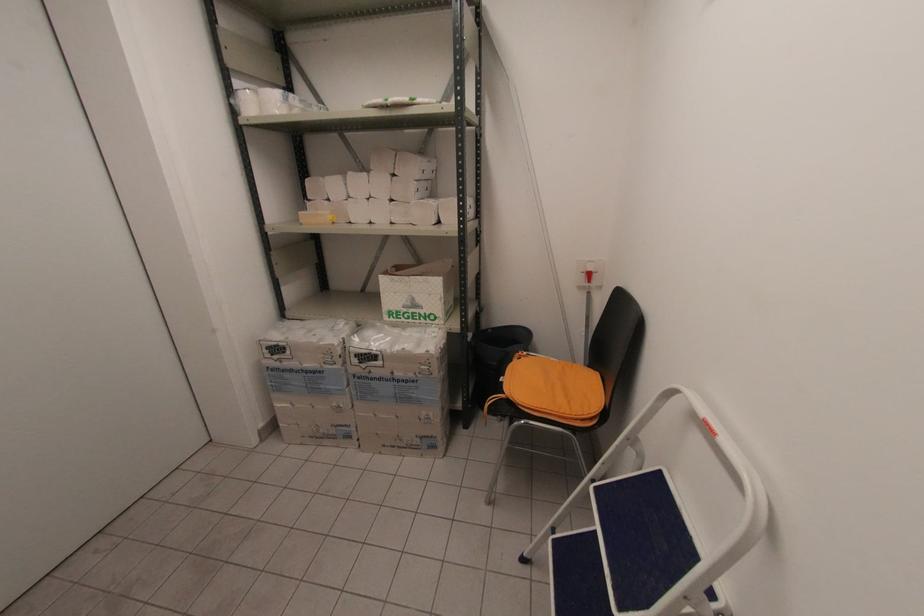
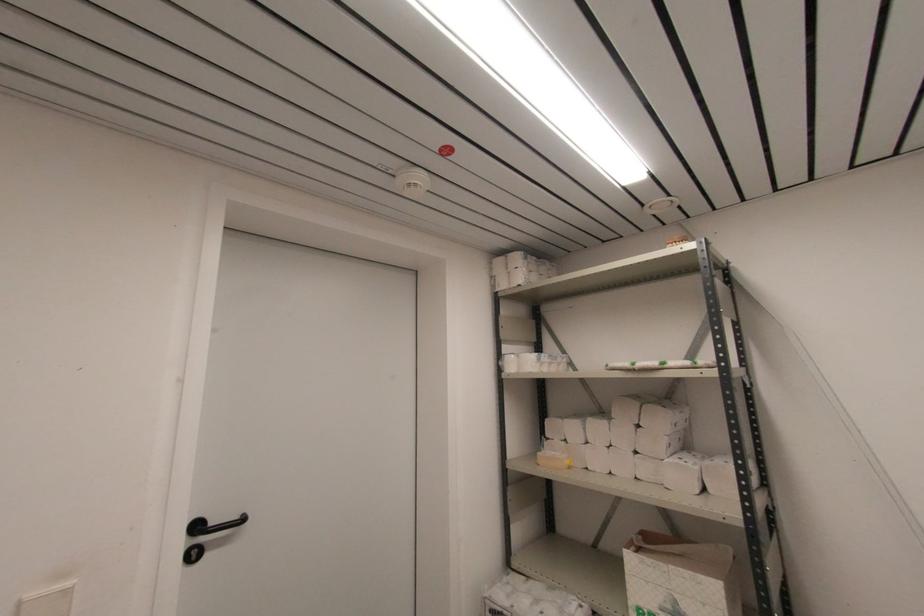
In the second image, find the point that corresponds to (x=310, y=198) in the first image.

(548, 436)